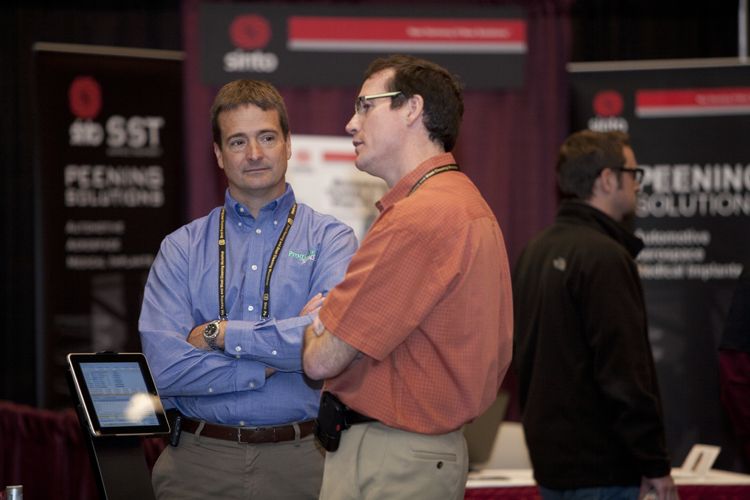
The width and height of the screenshot is (750, 500). I want to click on tablet computer, so click(116, 389).